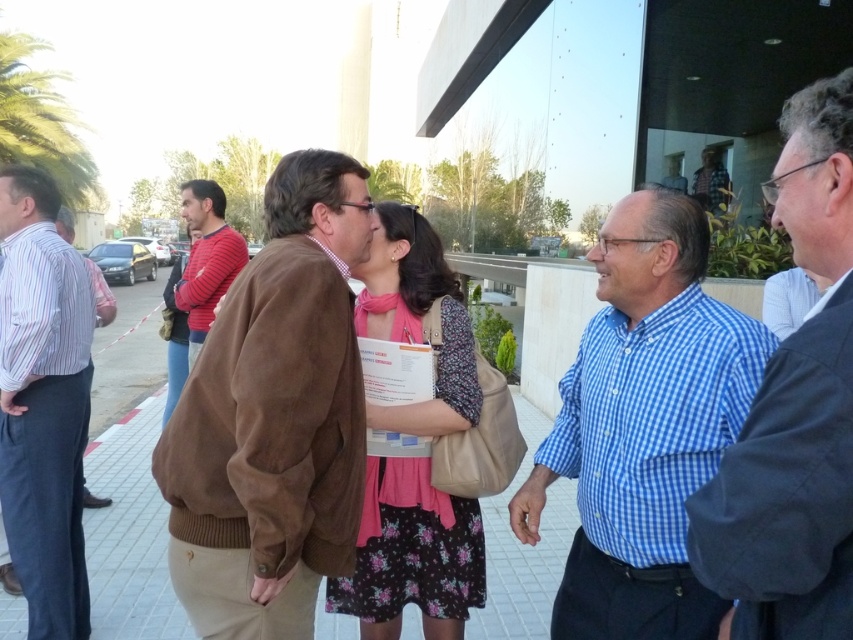
Question: Is floral dress at center to the right of striped cotton shirt at left from the viewer's perspective?

Choices:
 (A) no
 (B) yes

Answer: (B)

Question: Does dark blue checkered shirt at right have a larger size compared to floral dress at center?

Choices:
 (A) yes
 (B) no

Answer: (B)

Question: Observing the image, what is the correct spatial positioning of suede jacket at center in reference to blue checkered shirt at center?

Choices:
 (A) left
 (B) right

Answer: (A)

Question: Based on their relative distances, which object is farther from the dark blue checkered shirt at right?

Choices:
 (A) striped red and white shirt at left
 (B) striped cotton shirt at left

Answer: (A)

Question: Which point is farther from the camera taking this photo?

Choices:
 (A) pos(822,244)
 (B) pos(196,282)

Answer: (B)

Question: Based on their relative distances, which object is nearer to the striped cotton shirt at left?

Choices:
 (A) dark blue checkered shirt at right
 (B) suede jacket at center

Answer: (B)